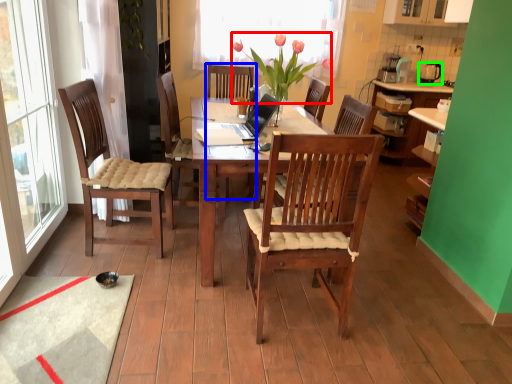
Question: Estimate the real-world distances between objects in this image. Which object is closer to flower (highlighted by a red box), armchair (highlighted by a blue box) or loudspeaker (highlighted by a green box)?

Choices:
 (A) armchair
 (B) loudspeaker

Answer: (A)